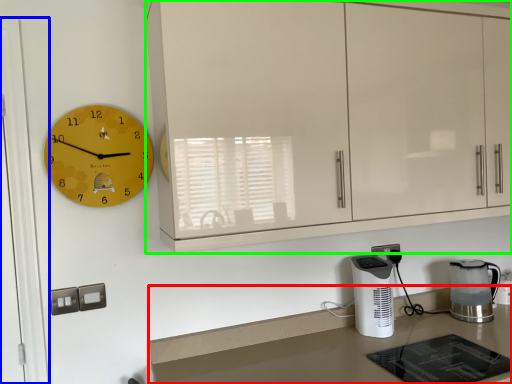
Question: Based on their relative distances, which object is farther from countertop (highlighted by a red box)? Choose from glass door (highlighted by a blue box) and cabinetry (highlighted by a green box).

Choices:
 (A) glass door
 (B) cabinetry

Answer: (A)